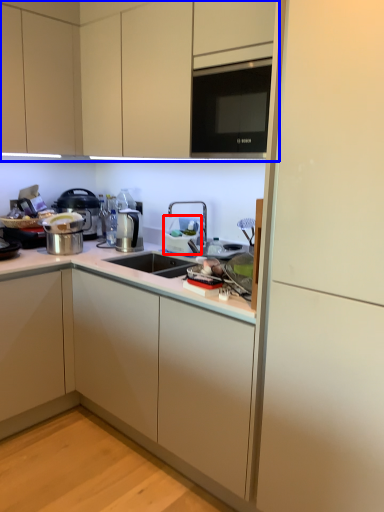
Question: Which object is further to the camera taking this photo, appliance (highlighted by a red box) or cabinetry (highlighted by a blue box)?

Choices:
 (A) appliance
 (B) cabinetry

Answer: (A)